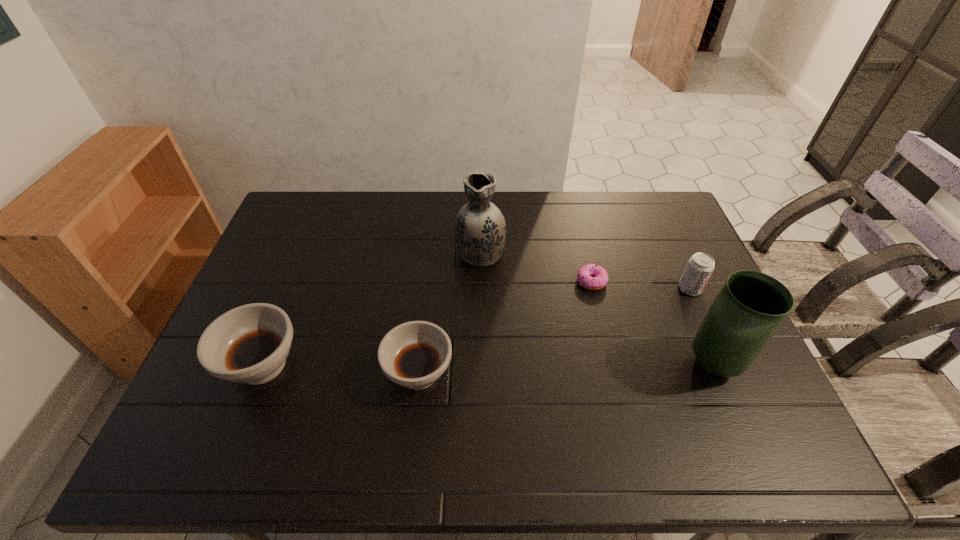
Image resolution: width=960 pixels, height=540 pixels. What are the coordinates of `vacant space in between the soda can and the second shortest object` in the screenshot? It's located at (554, 331).

I want to click on vacant space that is in between the right soup bowl and the nearer vase, so pyautogui.click(x=565, y=369).

I want to click on free area in between the fifth tallest object and the doughnut, so click(x=505, y=327).

This screenshot has width=960, height=540. Identify the location of free spot between the left soup bowl and the right vase. (488, 364).

This screenshot has height=540, width=960. In order to click on free space between the right vase and the shorter soup bowl in this screenshot , I will do `click(565, 369)`.

At what (x,y) coordinates should I click in order to perform the action: click on free space between the shorter soup bowl and the nearer vase. Please return your answer as a coordinate pair (x, y). Looking at the image, I should click on (565, 369).

This screenshot has height=540, width=960. What are the coordinates of `free point between the shorter soup bowl and the shortest object` in the screenshot? It's located at (505, 327).

At what (x,y) coordinates should I click in order to perform the action: click on free point between the soda can and the doughnut. Please return your answer as a coordinate pair (x, y). The width and height of the screenshot is (960, 540). Looking at the image, I should click on [x=640, y=285].

This screenshot has width=960, height=540. What are the coordinates of `the third closest object to the soda can` in the screenshot? It's located at (480, 229).

Image resolution: width=960 pixels, height=540 pixels. Find the location of `object that ranks as the fifth closest to the shorter soup bowl`. object that ranks as the fifth closest to the shorter soup bowl is located at coordinates (700, 266).